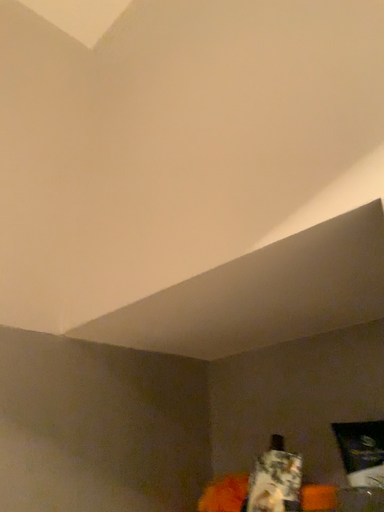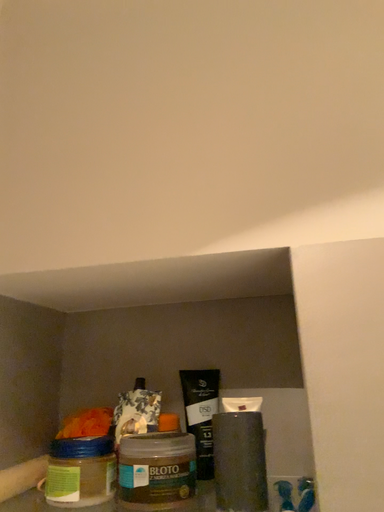
Question: Which way did the camera rotate in the video?

Choices:
 (A) rotated downward
 (B) rotated upward

Answer: (A)